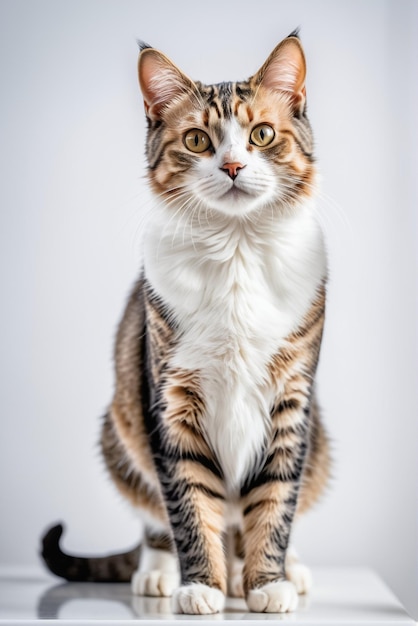
Locate an element on the screen. The image size is (418, 626). chest is located at coordinates (233, 351).